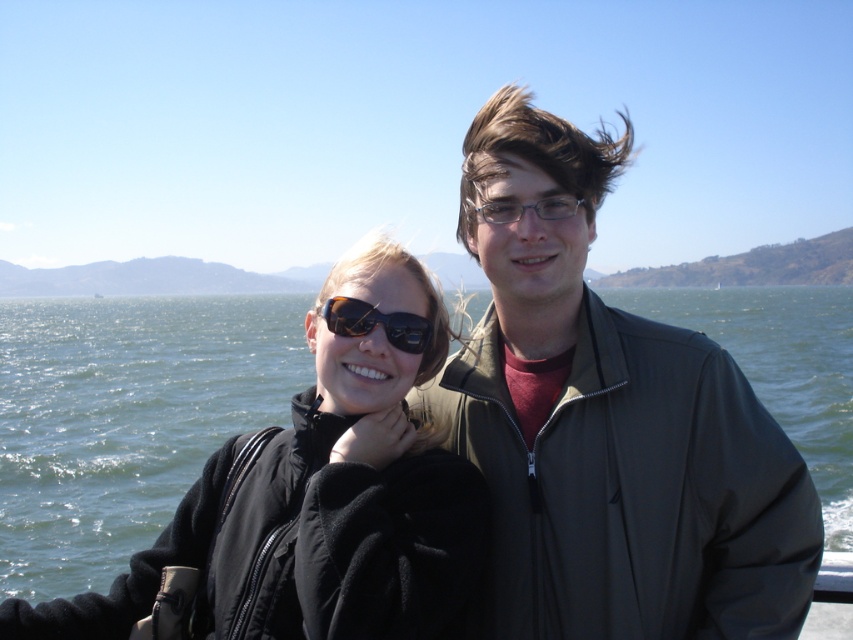
You are a photographer trying to capture the scene where the dark gray jacket at center and green water at center are both visible. Based on their positions, which object should appear lower in the photo?

The dark gray jacket at center is below green water at center, so it will appear lower in the photo.

You are a photographer trying to capture a clear shot of the dark gray jacket at center and the matte black sunglasses at center. Since you can only focus on one object at a time, which one should you focus on to ensure it appears sharp in the photo?

The dark gray jacket at center is closer to the viewer than the matte black sunglasses at center, so focusing on the dark gray jacket at center will ensure it appears sharp, and the matte black sunglasses at center may be slightly out of focus due to the distance between them.

You are a photographer trying to capture a clear shot of the green water at center and the matte black sunglasses at center. Which object is closer to the camera?

The green water at center is closer to the camera than the matte black sunglasses at center because the matte black sunglasses at center is behind the green water at center.